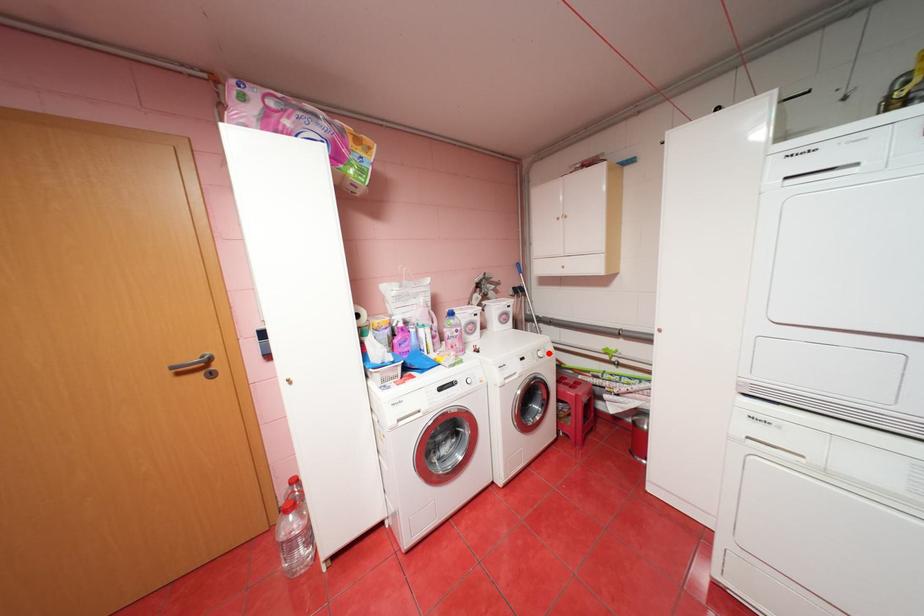
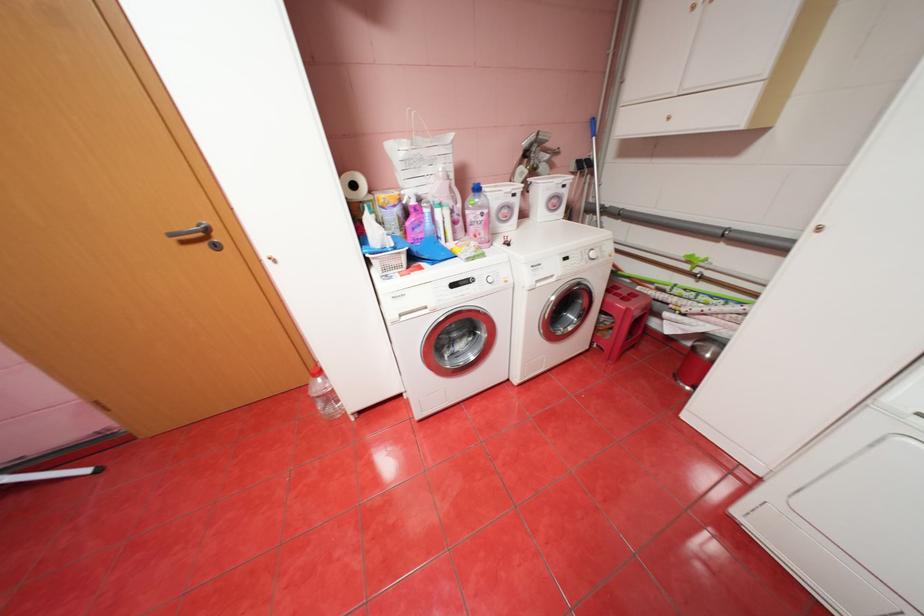
The point at the highlighted location is marked in the first image. Where is the corresponding point in the second image?

(602, 254)